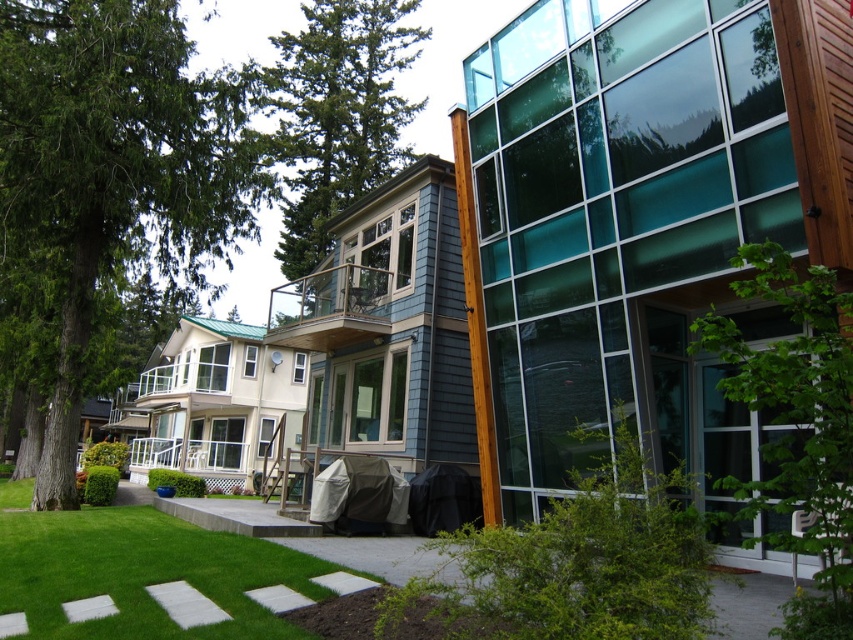
Who is higher up, green leafy bush at lower center or green grass at lower left?

green leafy bush at lower center is higher up.

This screenshot has height=640, width=853. Describe the element at coordinates (573, 564) in the screenshot. I see `green leafy bush at lower center` at that location.

Does point (560, 584) come farther from viewer compared to point (138, 554)?

No, (560, 584) is in front of (138, 554).

This screenshot has height=640, width=853. Identify the location of green leafy bush at lower center. (573, 564).

Which is above, green textured tree at left or green grass at lower left?

green textured tree at left

Which of these two, green textured tree at left or green grass at lower left, stands taller?

Standing taller between the two is green textured tree at left.

The width and height of the screenshot is (853, 640). Find the location of `green textured tree at left`. green textured tree at left is located at coordinates pyautogui.click(x=112, y=173).

Is green textured tree at left in front of green textured tree at upper center?

Yes, green textured tree at left is closer to the viewer.

Can you confirm if green textured tree at left is shorter than green textured tree at upper center?

Correct, green textured tree at left is not as tall as green textured tree at upper center.

I want to click on green textured tree at left, so click(x=112, y=173).

Find the location of a particular element. This screenshot has height=640, width=853. green textured tree at left is located at coordinates click(112, 173).